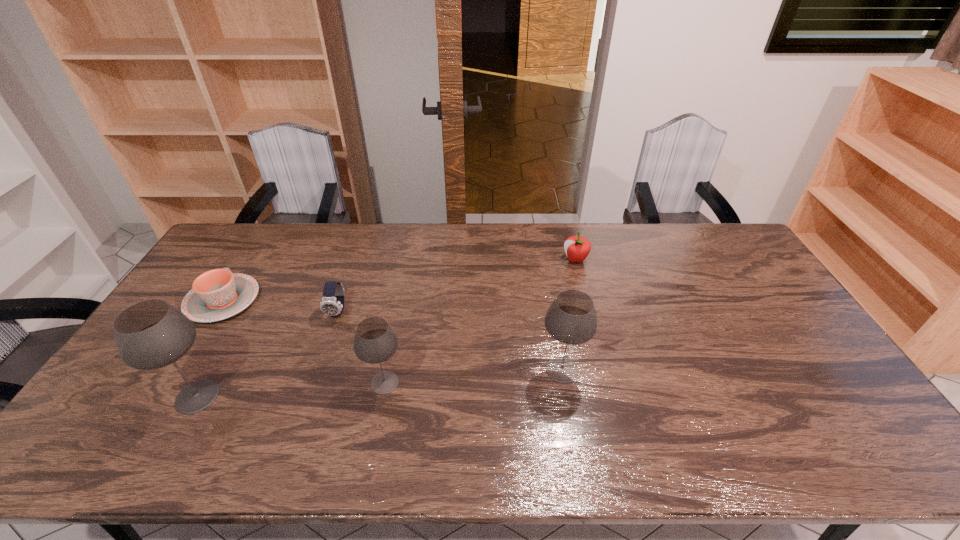
Where is `vacant area between the third object from left to right and the shortest object`? Image resolution: width=960 pixels, height=540 pixels. vacant area between the third object from left to right and the shortest object is located at coordinates (280, 306).

Find the location of a particular element. The height and width of the screenshot is (540, 960). free area in between the watch and the second object from right to left is located at coordinates (450, 340).

This screenshot has width=960, height=540. Identify the location of free space between the fifth object from left to right and the fourth object from right to left. (450, 340).

Point out which object is positioned as the fifth nearest to the shortest object. Please provide its 2D coordinates. Your answer should be formatted as a tuple, i.e. [(x, y)], where the tuple contains the x and y coordinates of a point satisfying the conditions above.

[(577, 248)]

This screenshot has height=540, width=960. I want to click on object that can be found as the fourth closest to the apple, so click(218, 294).

This screenshot has width=960, height=540. In order to click on the closest wineglass relative to the third tallest object in this screenshot , I will do `click(151, 334)`.

Identify which wineglass is located as the nearest to the leftmost wineglass. Please provide its 2D coordinates. Your answer should be formatted as a tuple, i.e. [(x, y)], where the tuple contains the x and y coordinates of a point satisfying the conditions above.

[(375, 341)]

Where is `free spot that satisfies the following two spatial constraints: 1. on the face of the watch; 2. on the left side of the second shortest wineglass`? Image resolution: width=960 pixels, height=540 pixels. free spot that satisfies the following two spatial constraints: 1. on the face of the watch; 2. on the left side of the second shortest wineglass is located at coordinates (319, 369).